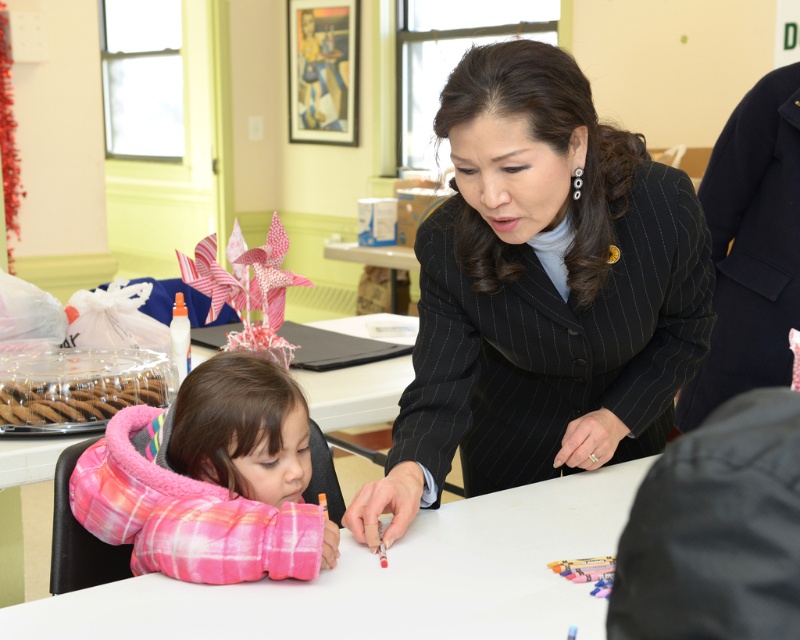
Question: Estimate the real-world distances between objects in this image. Which object is closer to the black pinstripe suit at upper right?

Choices:
 (A) pink fleece jacket at lower left
 (B) black pinstripe suit at center
 (C) white glossy table at center

Answer: (B)

Question: Considering the relative positions of white glossy table at center and pink fleece jacket at lower left in the image provided, where is white glossy table at center located with respect to pink fleece jacket at lower left?

Choices:
 (A) below
 (B) above

Answer: (A)

Question: Based on their relative distances, which object is farther from the white glossy table at center?

Choices:
 (A) black pinstripe suit at upper right
 (B) black pinstripe suit at center
 (C) pink fleece jacket at lower left

Answer: (A)

Question: Can you confirm if white glossy table at center is wider than pink fleece jacket at lower left?

Choices:
 (A) no
 (B) yes

Answer: (B)

Question: Is black pinstripe suit at center wider than white glossy table at center?

Choices:
 (A) no
 (B) yes

Answer: (A)

Question: Which object appears closest to the camera in this image?

Choices:
 (A) pink fleece jacket at lower left
 (B) black pinstripe suit at center

Answer: (B)